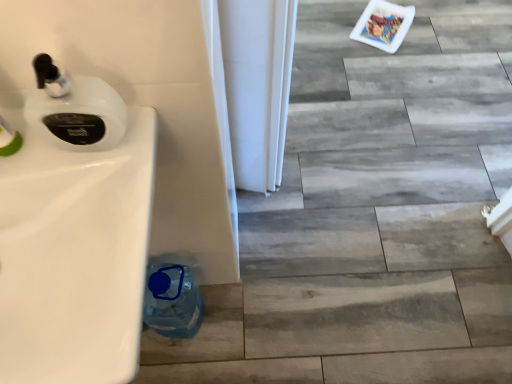
Locate an element on the screen. This screenshot has width=512, height=384. vacant area that is in front of white glossy soap dispenser at upper left is located at coordinates (96, 240).